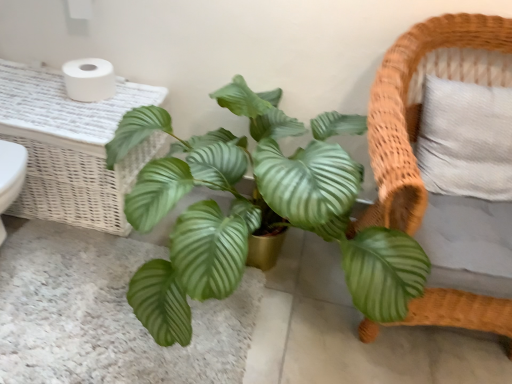
Image resolution: width=512 pixels, height=384 pixels. What do you see at coordinates (420, 105) in the screenshot? I see `woven wood chair at right` at bounding box center [420, 105].

Locate an element on the screen. white wicker table at upper left is located at coordinates (71, 147).

Locate an element on the screen. The height and width of the screenshot is (384, 512). green glossy leaf at center is located at coordinates tap(105, 314).

Looking at their sizes, would you say white wicker table at upper left is wider or thinner than green glossy leafy plant at center?

In the image, white wicker table at upper left appears to be more narrow than green glossy leafy plant at center.

Is white wicker table at upper left far from green glossy leafy plant at center?

white wicker table at upper left is actually quite close to green glossy leafy plant at center.

Is white wicker table at upper left inside or outside of green glossy leafy plant at center?

white wicker table at upper left is not enclosed by green glossy leafy plant at center.

From a real-world perspective, which object stands above the other?

green glossy leafy plant at center is physically above.

Does green glossy leafy plant at center contain white wicker table at upper left?

No, white wicker table at upper left is not a part of green glossy leafy plant at center.

Does point (296, 204) lie behind point (114, 127)?

No, (296, 204) is in front of (114, 127).

Considering the positions of objects green glossy leafy plant at center and white wicker table at upper left in the image provided, who is more to the left, green glossy leafy plant at center or white wicker table at upper left?

From the viewer's perspective, white wicker table at upper left appears more on the left side.

Can you tell me how much green glossy leafy plant at center and white wicker table at upper left differ in facing direction?

0.235 degrees.

Which is more to the right, white matte toilet paper at upper left or woven wood chair at right?

woven wood chair at right is more to the right.

Is white matte toilet paper at upper left completely or partially outside of woven wood chair at right?

white matte toilet paper at upper left is positioned outside woven wood chair at right.

From a real-world perspective, between white matte toilet paper at upper left and woven wood chair at right, who is vertically higher?

white matte toilet paper at upper left.

Can you see green glossy leaf at center touching green glossy leafy plant at center?

No, green glossy leaf at center is not in contact with green glossy leafy plant at center.

Would you say green glossy leaf at center contains green glossy leafy plant at center?

No, green glossy leaf at center does not contain green glossy leafy plant at center.

Considering the relative positions of green glossy leaf at center and green glossy leafy plant at center in the image provided, is green glossy leaf at center to the left or to the right of green glossy leafy plant at center?

green glossy leaf at center is to the left of green glossy leafy plant at center.

In the scene shown: Can you tell me how much green glossy leaf at center and green glossy leafy plant at center differ in facing direction?

0.235 degrees separate the facing orientations of green glossy leaf at center and green glossy leafy plant at center.

Considering the relative sizes of green glossy leafy plant at center and white matte toilet paper at upper left in the image provided, is green glossy leafy plant at center shorter than white matte toilet paper at upper left?

In fact, green glossy leafy plant at center may be taller than white matte toilet paper at upper left.

Can you confirm if green glossy leafy plant at center is thinner than white matte toilet paper at upper left?

In fact, green glossy leafy plant at center might be wider than white matte toilet paper at upper left.

From a real-world perspective, between green glossy leafy plant at center and white matte toilet paper at upper left, who is vertically lower?

From a 3D spatial view, green glossy leafy plant at center is below.

Is green glossy leafy plant at center at the right side of green glossy leaf at center?

Yes.

Are green glossy leafy plant at center and green glossy leaf at center beside each other?

No.

At what (x,y) coordinates should I click in order to perform the action: click on houseplant above the green glossy leaf at center (from the image's perspective). Please return your answer as a coordinate pair (x, y). The image size is (512, 384). Looking at the image, I should click on (255, 211).

Who is shorter, white matte toilet paper at upper left or green glossy leaf at center?

With less height is green glossy leaf at center.

How much distance is there between white matte toilet paper at upper left and green glossy leaf at center?

27.62 inches.

Is white matte toilet paper at upper left positioned behind green glossy leaf at center?

Yes, white matte toilet paper at upper left is further from the viewer.

Is point (74, 92) positioned after point (177, 370)?

That is True.

At what (x,y) coordinates should I click in order to perform the action: click on houseplant on the right of white wicker table at upper left. Please return your answer as a coordinate pair (x, y). Looking at the image, I should click on (255, 211).

Identify the location of table below the green glossy leafy plant at center (from a real-world perspective). This screenshot has width=512, height=384. (71, 147).

In the scene shown: Estimate the real-world distances between objects in this image. Which object is closer to white wicker table at upper left, green glossy leafy plant at center or white matte toilet paper at upper left?

Among the two, white matte toilet paper at upper left is located nearer to white wicker table at upper left.

Which object lies further to the anchor point white wicker table at upper left, green glossy leaf at center or green glossy leafy plant at center?

Among the two, green glossy leafy plant at center is located further to white wicker table at upper left.

Estimate the real-world distances between objects in this image. Which object is further from green glossy leaf at center, woven wood chair at right or white wicker table at upper left?

woven wood chair at right.

From the image, which object appears to be farther from green glossy leafy plant at center, white matte toilet paper at upper left or white wicker table at upper left?

Among the two, white matte toilet paper at upper left is located further to green glossy leafy plant at center.

Which object lies further to the anchor point green glossy leafy plant at center, white wicker table at upper left or white matte toilet paper at upper left?

Among the two, white matte toilet paper at upper left is located further to green glossy leafy plant at center.

Based on their spatial positions, is green glossy leaf at center or woven wood chair at right closer to white wicker table at upper left?

The object closer to white wicker table at upper left is green glossy leaf at center.

Estimate the real-world distances between objects in this image. Which object is closer to white wicker table at upper left, green glossy leafy plant at center or green glossy leaf at center?

Based on the image, green glossy leaf at center appears to be nearer to white wicker table at upper left.

Based on their spatial positions, is green glossy leafy plant at center or white wicker table at upper left closer to woven wood chair at right?

green glossy leafy plant at center.

The width and height of the screenshot is (512, 384). In order to click on table between white matte toilet paper at upper left and green glossy leaf at center from top to bottom in this screenshot , I will do `click(71, 147)`.

I want to click on toilet paper situated between white wicker table at upper left and green glossy leafy plant at center from left to right, so click(89, 79).

The width and height of the screenshot is (512, 384). I want to click on plain located between white wicker table at upper left and woven wood chair at right in the left-right direction, so click(105, 314).

This screenshot has height=384, width=512. What are the coordinates of `houseplant between white matte toilet paper at upper left and green glossy leaf at center from top to bottom` in the screenshot? It's located at pos(255,211).